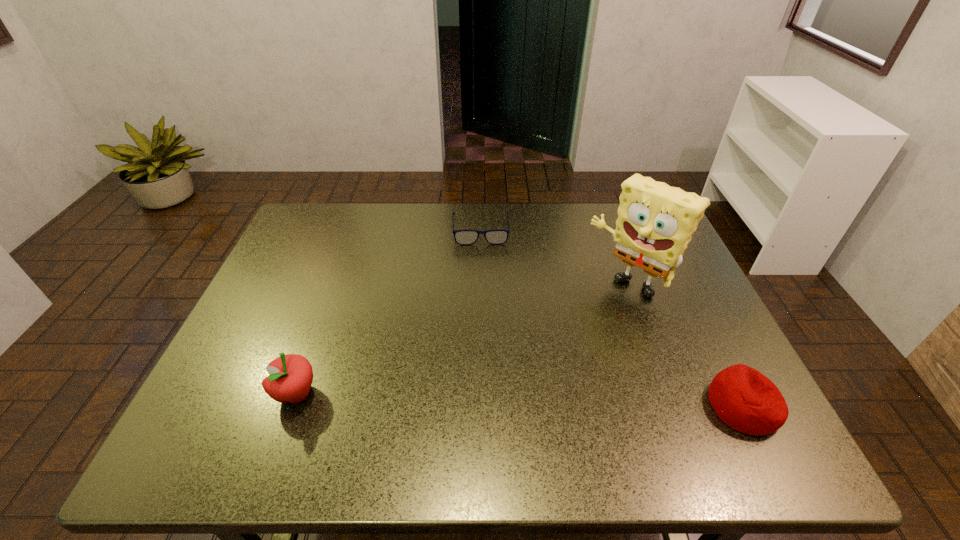
Where is `vacant space that satisfies the following two spatial constraints: 1. on the front side of the third nearest object; 2. on the seat area of the beanbag`? The width and height of the screenshot is (960, 540). vacant space that satisfies the following two spatial constraints: 1. on the front side of the third nearest object; 2. on the seat area of the beanbag is located at coordinates (672, 406).

Locate an element on the screen. vacant point that satisfies the following two spatial constraints: 1. on the front side of the third nearest object; 2. on the seat area of the third tallest object is located at coordinates (672, 406).